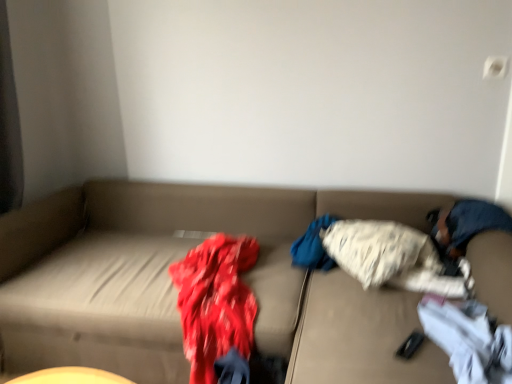
Question: In which direction should I rotate to look at fluffy white blanket at center, which is counted as the 1th clothing, starting from the back?

Choices:
 (A) left
 (B) right

Answer: (B)

Question: Considering the relative positions of blue denim jeans at right and fluffy white blanket at center, which is counted as the 1th clothing, starting from the back, in the image provided, is blue denim jeans at right to the right of fluffy white blanket at center, which is counted as the 1th clothing, starting from the back, from the viewer's perspective?

Choices:
 (A) no
 (B) yes

Answer: (B)

Question: Is blue denim jeans at right looking in the opposite direction of fluffy white blanket at center, which is counted as the 1th clothing, starting from the back?

Choices:
 (A) yes
 (B) no

Answer: (A)

Question: Does blue denim jeans at right have a lesser height compared to fluffy white blanket at center, the second clothing from the front?

Choices:
 (A) yes
 (B) no

Answer: (B)

Question: Is fluffy white blanket at center, which is counted as the 1th clothing, starting from the back, a part of blue denim jeans at right?

Choices:
 (A) no
 (B) yes

Answer: (A)

Question: Can you confirm if blue denim jeans at right is smaller than fluffy white blanket at center, which is counted as the 1th clothing, starting from the back?

Choices:
 (A) yes
 (B) no

Answer: (B)

Question: Considering the relative sizes of blue denim jeans at right and fluffy white blanket at center, the second clothing from the front, in the image provided, is blue denim jeans at right bigger than fluffy white blanket at center, the second clothing from the front,?

Choices:
 (A) no
 (B) yes

Answer: (B)

Question: Can you confirm if beige fabric couch at center is positioned to the left of blue denim jeans at right?

Choices:
 (A) no
 (B) yes

Answer: (B)

Question: Is beige fabric couch at center positioned before blue denim jeans at right?

Choices:
 (A) yes
 (B) no

Answer: (A)

Question: From a real-world perspective, does beige fabric couch at center sit lower than blue denim jeans at right?

Choices:
 (A) no
 (B) yes

Answer: (B)

Question: Would you say blue denim jeans at right is part of beige fabric couch at center's contents?

Choices:
 (A) no
 (B) yes

Answer: (B)

Question: Does beige fabric couch at center have a greater height compared to blue denim jeans at right?

Choices:
 (A) yes
 (B) no

Answer: (A)

Question: Can you confirm if beige fabric couch at center is positioned to the right of blue denim jeans at right?

Choices:
 (A) no
 (B) yes

Answer: (A)

Question: Is fluffy white blanket at center, which is counted as the 1th clothing, starting from the back, taller than white cotton socks at lower right, the first clothing from the front?

Choices:
 (A) no
 (B) yes

Answer: (B)